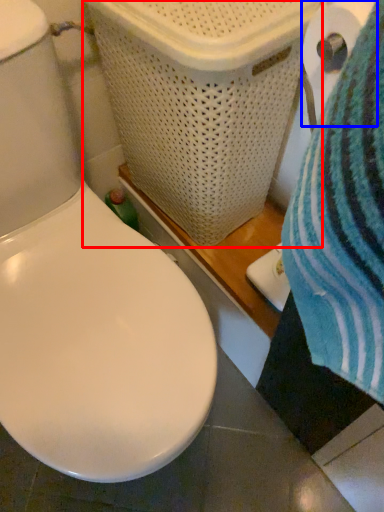
Question: Which object is further to the camera taking this photo, laundry basket (highlighted by a red box) or toilet paper (highlighted by a blue box)?

Choices:
 (A) laundry basket
 (B) toilet paper

Answer: (A)